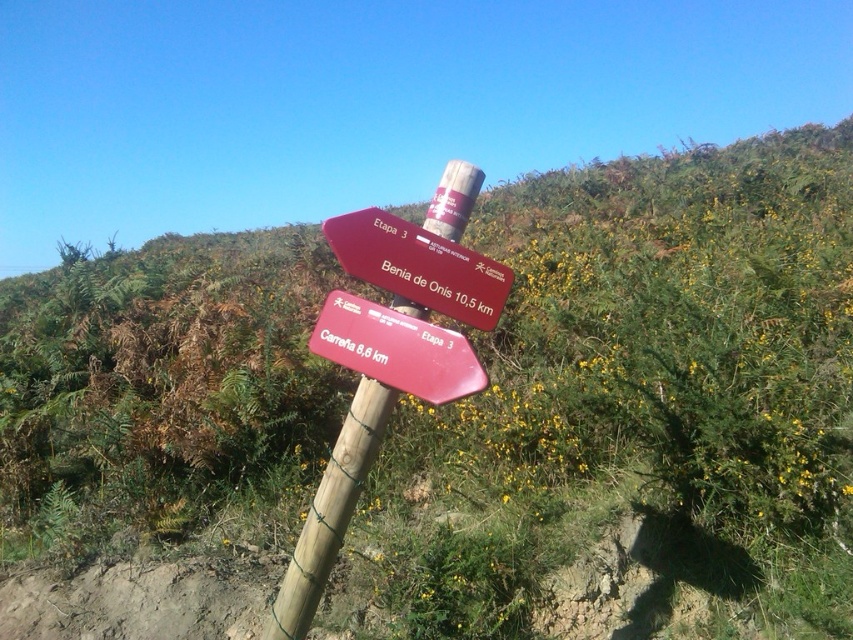
You are a hiker planning to reach Benia de Onis and see the wooden post at center and the red matte signpost at center. Which object should you look at to determine the correct direction and distance?

You should look at the red matte signpost at center because it contains directional information pointing to Benia de Onis with the distance of 10.5 km, while the wooden post at center is just the supporting structure.

You are standing in a rural area and see the wooden post at center and the red plastic sign at center. Which object is located to the right of the other?

The red plastic sign at center is located to the right of the wooden post at center because the wooden post at center is positioned on the left side of the red plastic sign at center.